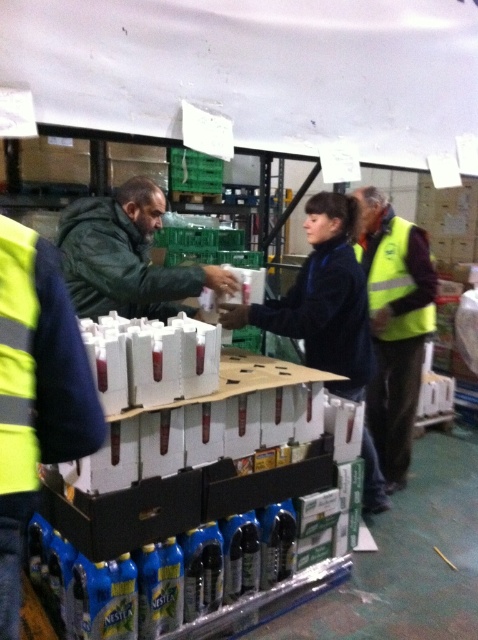
Question: Is yellow reflective vest at right to the left of yellow reflective safety vest at right from the viewer's perspective?

Choices:
 (A) yes
 (B) no

Answer: (A)

Question: Based on their relative distances, which object is nearer to the yellow reflective vest at right?

Choices:
 (A) yellow reflective safety vest at right
 (B) green matte jacket at center

Answer: (A)

Question: From the image, what is the correct spatial relationship of green matte jacket at center in relation to yellow reflective safety vest at right?

Choices:
 (A) left
 (B) right

Answer: (A)

Question: Which point appears closest to the camera in this image?

Choices:
 (A) (387, 200)
 (B) (387, 268)

Answer: (B)

Question: Considering the real-world distances, which object is closest to the yellow reflective vest at right?

Choices:
 (A) green matte jacket at center
 (B) yellow reflective safety vest at right

Answer: (B)

Question: Can you confirm if green matte jacket at center is positioned to the right of yellow reflective safety vest at right?

Choices:
 (A) no
 (B) yes

Answer: (A)